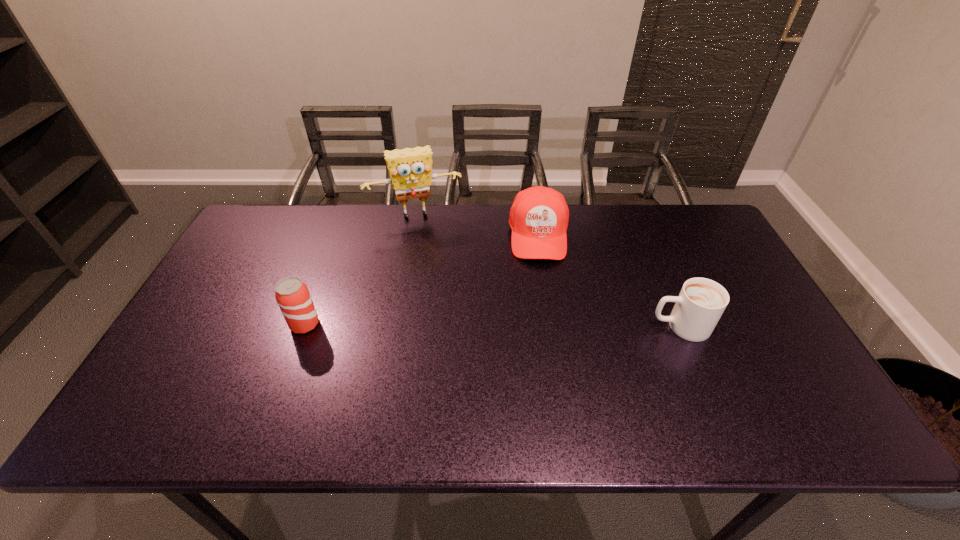
You are a GUI agent. You are given a task and a screenshot of the screen. Output one action in this format:
    pyautogui.click(x=<x>, y=<y>)
    Task: Click on the free space that is in between the baseball cap and the tallest object
    The width and height of the screenshot is (960, 540).
    Given the screenshot: What is the action you would take?
    pyautogui.click(x=477, y=225)

Where is `free space between the baseball cap and the sponge`? This screenshot has width=960, height=540. free space between the baseball cap and the sponge is located at coordinates (477, 225).

Locate which object is the third closest to the second object from right to left. Please provide its 2D coordinates. Your answer should be formatted as a tuple, i.e. [(x, y)], where the tuple contains the x and y coordinates of a point satisfying the conditions above.

[(292, 295)]

Point out which object is positioned as the nearest to the beer can. Please provide its 2D coordinates. Your answer should be formatted as a tuple, i.e. [(x, y)], where the tuple contains the x and y coordinates of a point satisfying the conditions above.

[(410, 169)]

The image size is (960, 540). What are the coordinates of `free location that satisfies the following two spatial constraints: 1. on the front side of the baseball cap; 2. on the right side of the third object from right to left` in the screenshot? It's located at (412, 235).